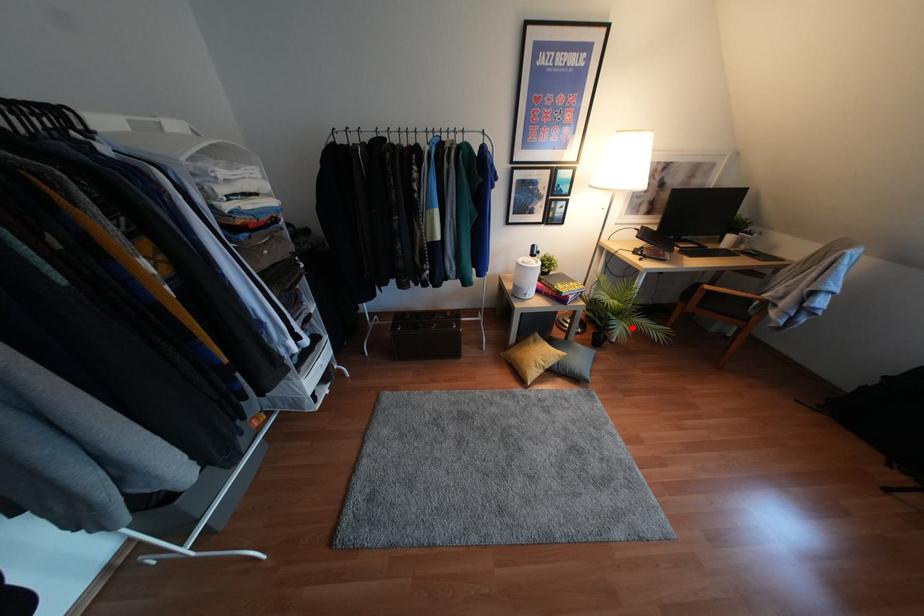
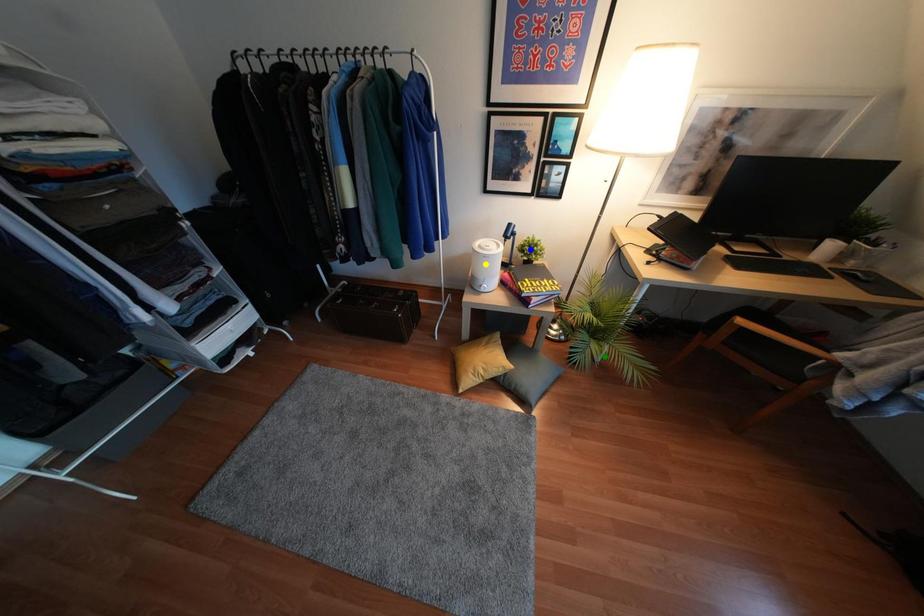
Question: I am providing you with two images of the same scene from different viewpoints. A red point is marked on the first image. You are given multiple points on the second image. Which mark in image 2 goes with the point in image 1?

Choices:
 (A) green point
 (B) yellow point
 (C) blue point

Answer: (A)